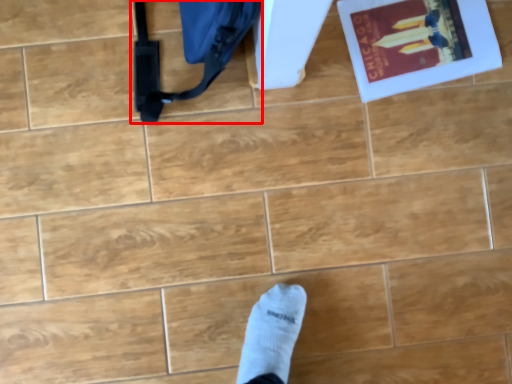
Question: From the image's perspective, what is the correct spatial positioning of messenger bag (annotated by the red box) in reference to paperback book?

Choices:
 (A) below
 (B) above

Answer: (A)